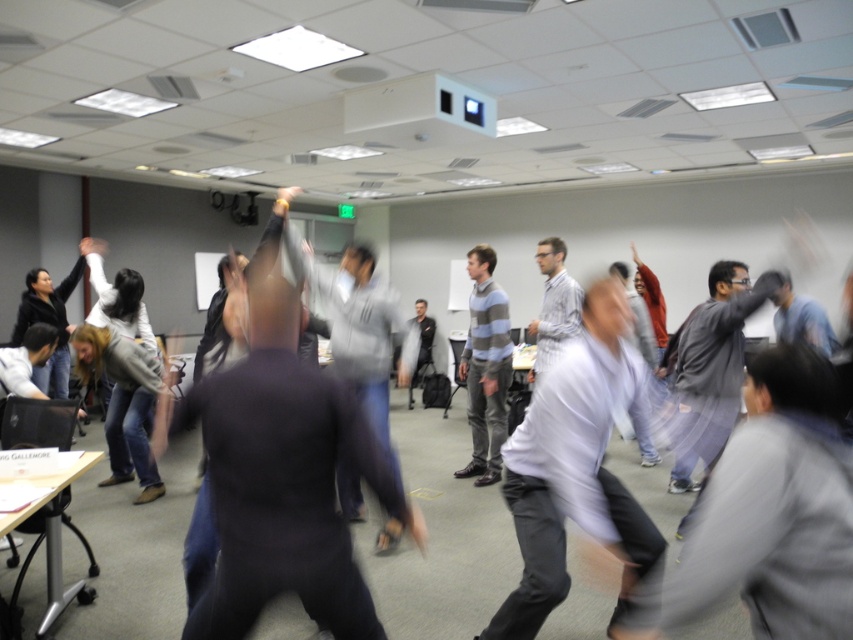
Question: Which is farther from the gray fabric shirt at center?

Choices:
 (A) matte black hand at upper center
 (B) white plastic projector at upper center
 (C) white shirt at center
 (D) matte black hand at upper left

Answer: (D)

Question: Is gray fabric shirt at center to the right of white shirt at center from the viewer's perspective?

Choices:
 (A) yes
 (B) no

Answer: (A)

Question: Estimate the real-world distances between objects in this image. Which object is closer to the striped sweater at center?

Choices:
 (A) white plastic projector at upper center
 (B) matte black hand at upper left

Answer: (A)

Question: Does gray fabric shirt at center appear on the right side of striped sweater at center?

Choices:
 (A) yes
 (B) no

Answer: (A)

Question: Does gray fabric shirt at center appear on the right side of striped sweater at center?

Choices:
 (A) yes
 (B) no

Answer: (A)

Question: Which of these objects is positioned farthest from the white plastic projector at upper center?

Choices:
 (A) matte black hand at upper left
 (B) matte black hand at upper center
 (C) gray fabric shirt at center

Answer: (A)